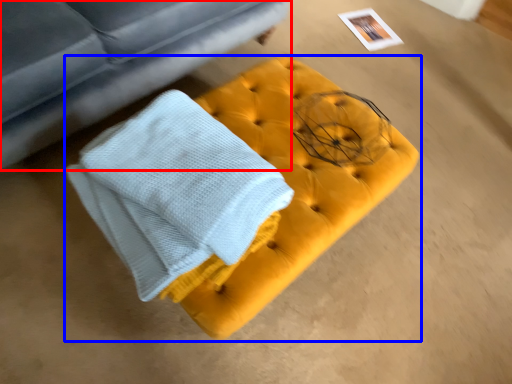
Question: Which object is closer to the camera taking this photo, studio couch (highlighted by a red box) or furniture (highlighted by a blue box)?

Choices:
 (A) studio couch
 (B) furniture

Answer: (A)